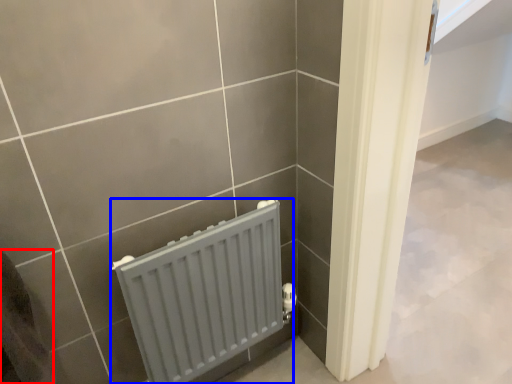
Question: Which of the following is the farthest to the observer, gray (highlighted by a red box) or radiator (highlighted by a blue box)?

Choices:
 (A) gray
 (B) radiator

Answer: (B)